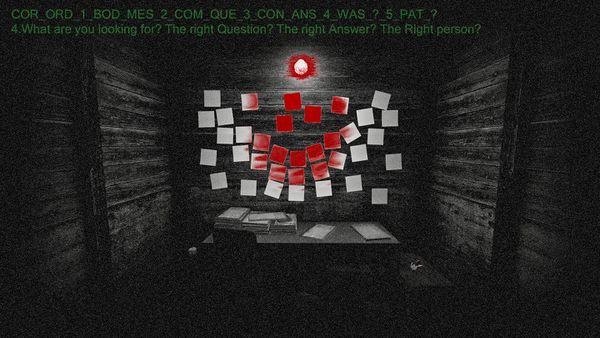
Where is `bench to sit on`? The height and width of the screenshot is (338, 600). bench to sit on is located at coordinates (419, 282).